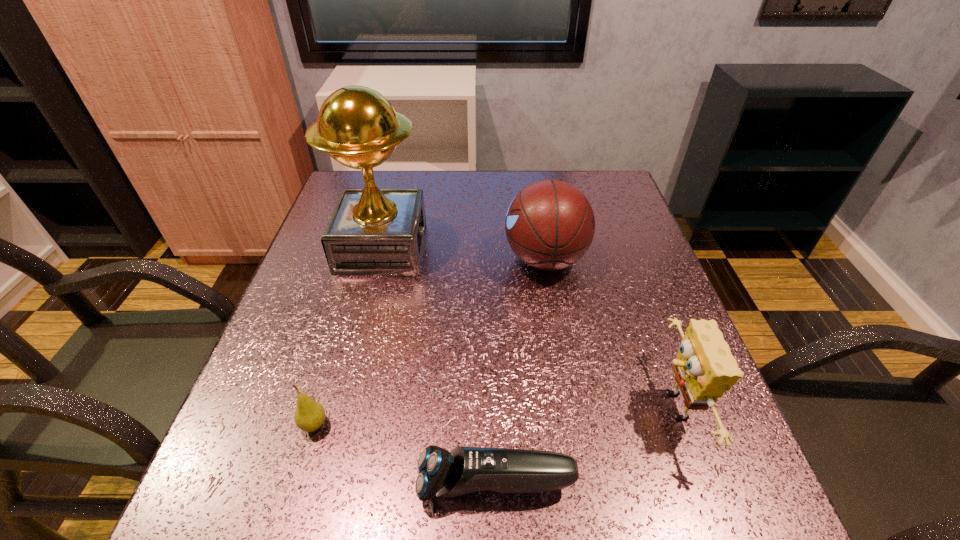
In order to click on vacant space at the far edge in this screenshot , I will do `click(397, 172)`.

Locate an element on the screen. Image resolution: width=960 pixels, height=540 pixels. free space at the left edge of the desktop is located at coordinates (307, 276).

The width and height of the screenshot is (960, 540). Find the location of `free region at the right edge`. free region at the right edge is located at coordinates (594, 257).

Image resolution: width=960 pixels, height=540 pixels. In the image, there is a desktop. Find the location of `vacant space at the far right corner`. vacant space at the far right corner is located at coordinates (624, 212).

This screenshot has width=960, height=540. In the image, there is a desktop. What are the coordinates of `free space at the near right corner` in the screenshot? It's located at (715, 501).

This screenshot has height=540, width=960. In order to click on free spot between the third tallest object and the basketball in this screenshot , I will do point(609,333).

The image size is (960, 540). Find the location of `vacant region between the pear and the award`. vacant region between the pear and the award is located at coordinates (348, 336).

Locate an element on the screen. The image size is (960, 540). vacant space that's between the sponge and the pear is located at coordinates (493, 416).

Where is `vacant point located between the sponge and the basketball`? The width and height of the screenshot is (960, 540). vacant point located between the sponge and the basketball is located at coordinates (609, 333).

I want to click on blank region between the sponge and the pear, so click(493, 416).